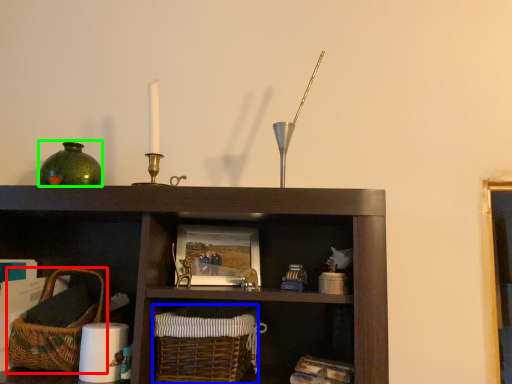
Question: Estimate the real-world distances between objects in this image. Which object is farther from basket (highlighted by a red box), basket (highlighted by a blue box) or glass vase (highlighted by a green box)?

Choices:
 (A) basket
 (B) glass vase

Answer: (B)